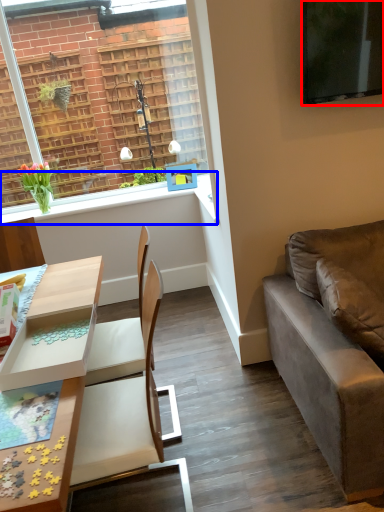
Question: Which object appears farthest to the camera in this image, television (highlighted by a red box) or window sill (highlighted by a blue box)?

Choices:
 (A) television
 (B) window sill

Answer: (B)